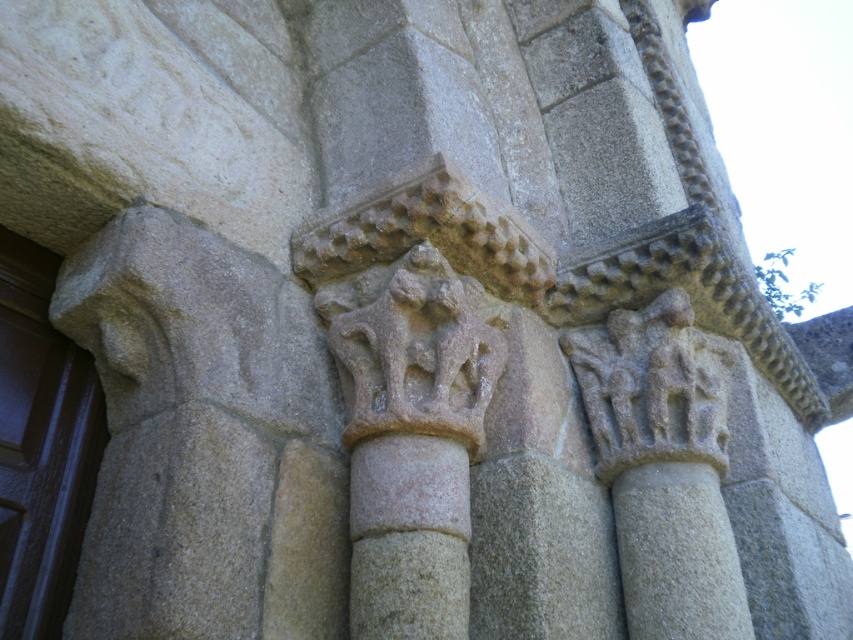
Question: Does pink stone column at center have a greater width compared to gray stone figures at upper right?

Choices:
 (A) no
 (B) yes

Answer: (A)

Question: Is pink stone column at center to the right of smooth stone column at center from the viewer's perspective?

Choices:
 (A) no
 (B) yes

Answer: (A)

Question: Is pink stone column at center smaller than gray stone figures at upper right?

Choices:
 (A) no
 (B) yes

Answer: (B)

Question: Which point is closer to the camera?

Choices:
 (A) (399, 524)
 (B) (624, 417)
 (C) (672, 627)
 (D) (405, 291)

Answer: (A)

Question: Among these points, which one is farthest from the camera?

Choices:
 (A) (392, 513)
 (B) (683, 420)
 (C) (676, 474)
 (D) (392, 422)

Answer: (B)

Question: Which of the following is the closest to the observer?

Choices:
 (A) smooth stone column at center
 (B) gray stone carving at center
 (C) pink stone column at center

Answer: (C)